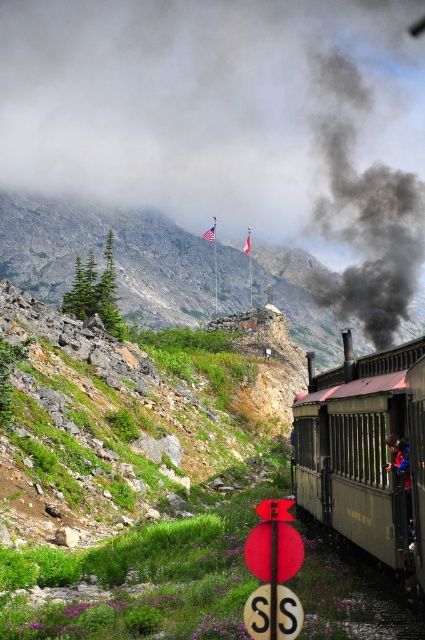
Question: Can you confirm if matte black train at right is wider than black smoke at upper center?

Choices:
 (A) no
 (B) yes

Answer: (A)

Question: Which of the following is the farthest from the observer?

Choices:
 (A) (x=308, y=268)
 (B) (x=350, y=188)

Answer: (B)

Question: Does matte black train at right appear under black smoke at upper center?

Choices:
 (A) yes
 (B) no

Answer: (A)

Question: Among these points, which one is nearest to the camera?

Choices:
 (A) (388, 269)
 (B) (418, 364)
 (C) (328, 321)

Answer: (B)

Question: Which object appears farthest from the camera in this image?

Choices:
 (A) black smoke at upper center
 (B) rugged stone mountain at upper center

Answer: (A)

Question: From the image, what is the correct spatial relationship of rugged stone mountain at upper center in relation to matte black train at right?

Choices:
 (A) right
 (B) left

Answer: (B)